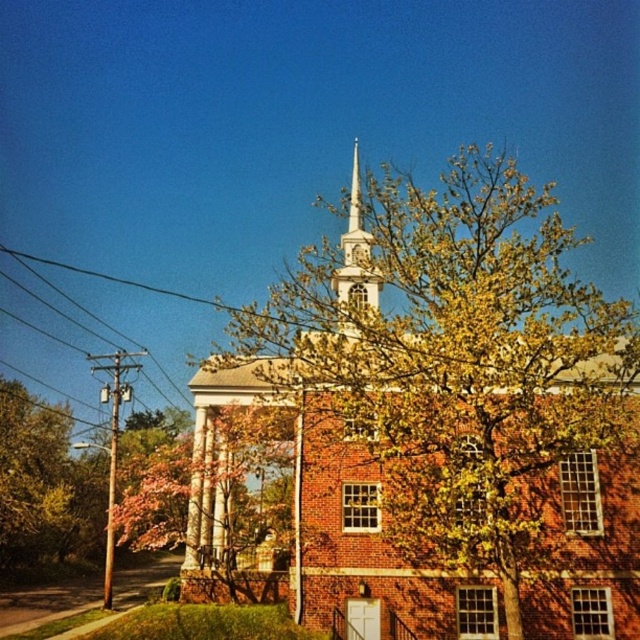
Question: Among these objects, which one is farthest from the camera?

Choices:
 (A) green leafy tree at left
 (B) white steeple at center

Answer: (A)

Question: Does green leafy tree at left appear on the right side of white steeple at center?

Choices:
 (A) yes
 (B) no

Answer: (B)

Question: Estimate the real-world distances between objects in this image. Which object is closer to the white steeple at center?

Choices:
 (A) green leafy tree at center
 (B) black wire at left
 (C) green leafy tree at left

Answer: (A)

Question: Which of the following is the closest to the observer?

Choices:
 (A) black wire at left
 (B) green leafy tree at left

Answer: (B)

Question: Is green leafy tree at left wider than black wire at left?

Choices:
 (A) no
 (B) yes

Answer: (A)

Question: Can you confirm if green leafy tree at center is thinner than green leafy tree at left?

Choices:
 (A) yes
 (B) no

Answer: (B)